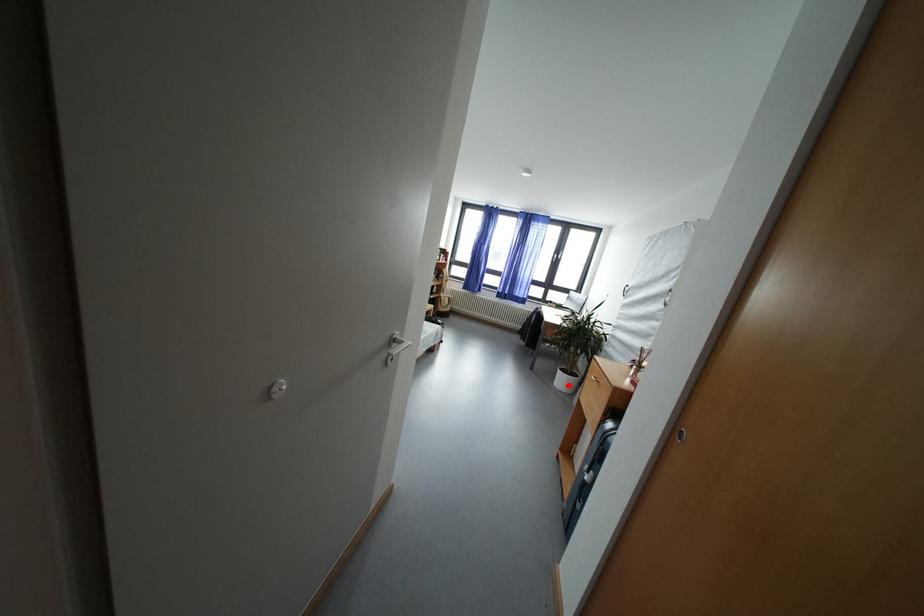
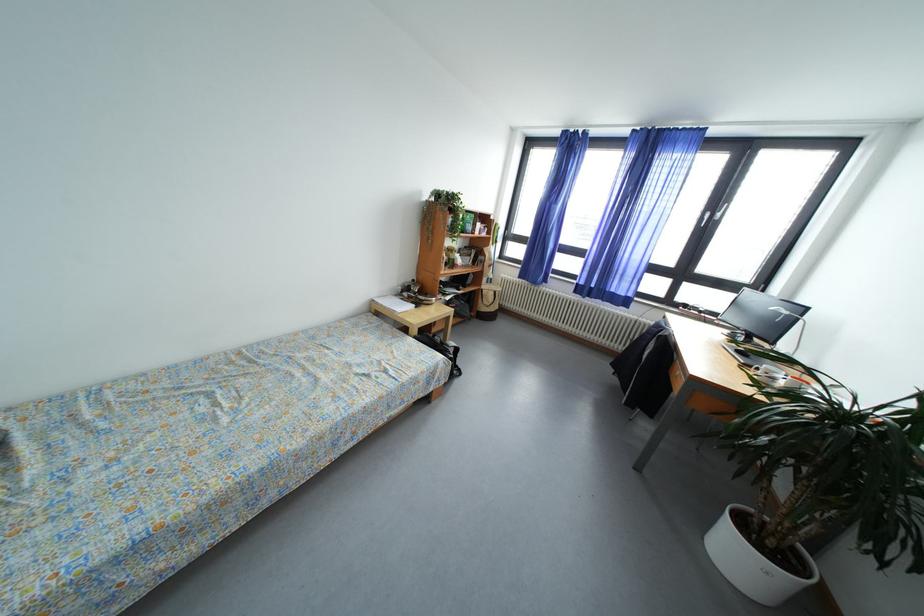
Question: I am providing you with two images of the same scene from different viewpoints. In image1, a red point is highlighted. Considering the same 3D point in image2, which of the following is correct?

Choices:
 (A) It is closer
 (B) It is farther

Answer: (B)